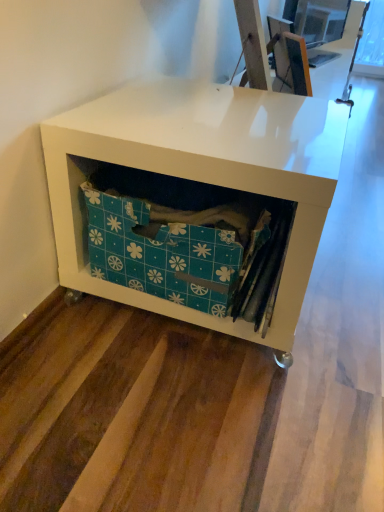
What do you see at coordinates (202, 173) in the screenshot? I see `white matte storage unit at lower left` at bounding box center [202, 173].

Find the location of `white matte storage unit at lower left`. white matte storage unit at lower left is located at coordinates (202, 173).

The image size is (384, 512). Identify the location of teal fabric storage box at center. (161, 251).

What do you see at coordinates (161, 251) in the screenshot? This screenshot has width=384, height=512. I see `teal fabric storage box at center` at bounding box center [161, 251].

Locate an element on the screen. white matte storage unit at lower left is located at coordinates (202, 173).

Is white matte storage unit at lower left at the right side of teal fabric storage box at center?

Correct, you'll find white matte storage unit at lower left to the right of teal fabric storage box at center.

Which object is further away from the camera, white matte storage unit at lower left or teal fabric storage box at center?

teal fabric storage box at center is more distant.

Looking at this image, which is closer, (191, 96) or (122, 224)?

Clearly, point (191, 96) is more distant from the camera than point (122, 224).

From the image's perspective, which object appears higher, white matte storage unit at lower left or teal fabric storage box at center?

white matte storage unit at lower left.

In the scene shown: From a real-world perspective, who is located lower, white matte storage unit at lower left or teal fabric storage box at center?

In real-world perspective, white matte storage unit at lower left is lower.

In the scene shown: Which object is thinner, white matte storage unit at lower left or teal fabric storage box at center?

With smaller width is teal fabric storage box at center.

Which of these two, white matte storage unit at lower left or teal fabric storage box at center, stands taller?

With more height is white matte storage unit at lower left.

Can you confirm if white matte storage unit at lower left is bigger than teal fabric storage box at center?

Indeed, white matte storage unit at lower left has a larger size compared to teal fabric storage box at center.

Do you think white matte storage unit at lower left is within teal fabric storage box at center, or outside of it?

white matte storage unit at lower left is not enclosed by teal fabric storage box at center.

Is white matte storage unit at lower left not close to teal fabric storage box at center?

No, white matte storage unit at lower left is not far away from teal fabric storage box at center.

Is white matte storage unit at lower left oriented away from teal fabric storage box at center?

Yes, teal fabric storage box at center is at the back of white matte storage unit at lower left.

What's the angular difference between white matte storage unit at lower left and teal fabric storage box at center's facing directions?

They differ by 95 degrees in their facing directions.

The height and width of the screenshot is (512, 384). Find the location of `storage box on the left of the white matte storage unit at lower left`. storage box on the left of the white matte storage unit at lower left is located at coordinates (161, 251).

Between teal fabric storage box at center and white matte storage unit at lower left, which one appears on the right side from the viewer's perspective?

white matte storage unit at lower left.

Which object is more forward, teal fabric storage box at center or white matte storage unit at lower left?

white matte storage unit at lower left is in front.

Between point (116, 192) and point (94, 280), which one is positioned in front?

The point (116, 192) is in front.

From the image's perspective, between teal fabric storage box at center and white matte storage unit at lower left, which one is located above?

white matte storage unit at lower left, from the image's perspective.

From a real-world perspective, is teal fabric storage box at center on top of white matte storage unit at lower left?

Yes, from a real-world perspective, teal fabric storage box at center is above white matte storage unit at lower left.

In terms of width, does teal fabric storage box at center look wider or thinner when compared to white matte storage unit at lower left?

Clearly, teal fabric storage box at center has less width compared to white matte storage unit at lower left.

From their relative heights in the image, would you say teal fabric storage box at center is taller or shorter than white matte storage unit at lower left?

Considering their sizes, teal fabric storage box at center has less height than white matte storage unit at lower left.

Considering the sizes of objects teal fabric storage box at center and white matte storage unit at lower left in the image provided, who is bigger, teal fabric storage box at center or white matte storage unit at lower left?

Bigger between the two is white matte storage unit at lower left.

Can white matte storage unit at lower left be found inside teal fabric storage box at center?

Definitely not — white matte storage unit at lower left is not inside teal fabric storage box at center.

Is there a large distance between teal fabric storage box at center and white matte storage unit at lower left?

No, there isn't a large distance between teal fabric storage box at center and white matte storage unit at lower left.

Is teal fabric storage box at center facing towards white matte storage unit at lower left?

Yes, teal fabric storage box at center faces towards white matte storage unit at lower left.

Identify the location of storage box below the white matte storage unit at lower left (from the image's perspective). This screenshot has width=384, height=512. (161, 251).

The height and width of the screenshot is (512, 384). Identify the location of storage box lying behind the white matte storage unit at lower left. (161, 251).

Where is `desk in front of the teal fabric storage box at center`? The image size is (384, 512). desk in front of the teal fabric storage box at center is located at coordinates (202, 173).